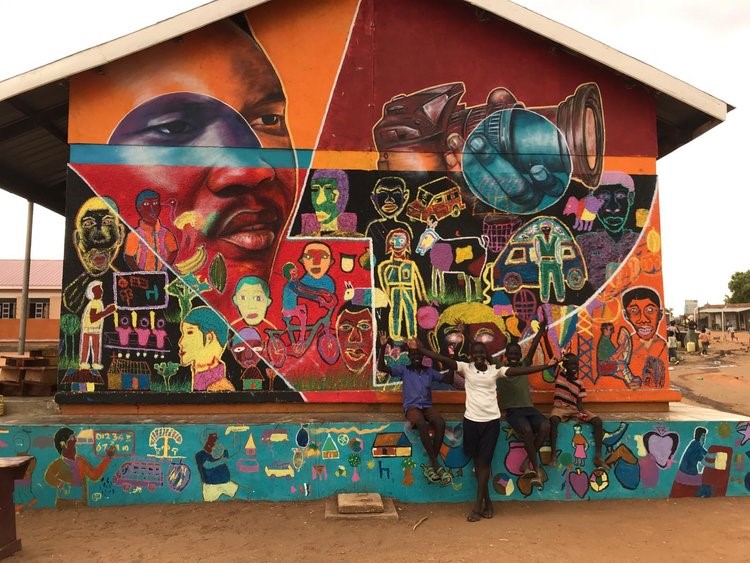
At what (x,y) coordinates should I click in order to perform the action: click on murals. Please return your answer as a coordinate pair (x, y). Looking at the image, I should click on (360, 205), (352, 439).